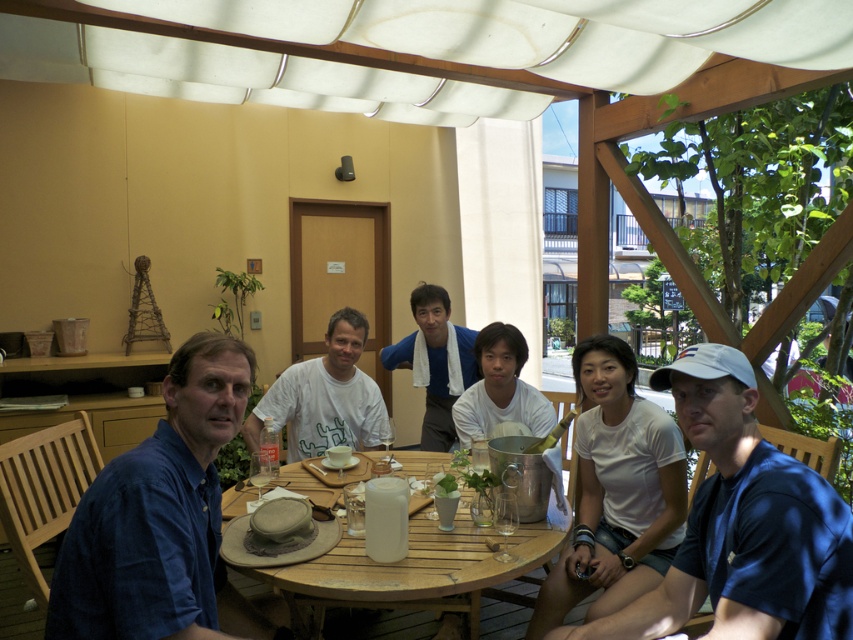
Question: Which of the following is the closest to the observer?

Choices:
 (A) (776, 536)
 (B) (447, 323)
 (C) (345, 376)

Answer: (A)

Question: Which point appears farthest from the camera in this image?

Choices:
 (A) (392, 353)
 (B) (47, 625)
 (C) (294, 428)

Answer: (A)

Question: Can you confirm if blue cotton shirt at left is positioned to the left of white cotton towel at center?

Choices:
 (A) yes
 (B) no

Answer: (A)

Question: Does blue fabric cap at right appear on the right side of wooden at center?

Choices:
 (A) no
 (B) yes

Answer: (B)

Question: Does blue cotton shirt at left have a greater width compared to white cotton towel at center?

Choices:
 (A) yes
 (B) no

Answer: (B)

Question: Which point is farther from the camera taking this photo?

Choices:
 (A) (421, 371)
 (B) (723, 358)

Answer: (A)